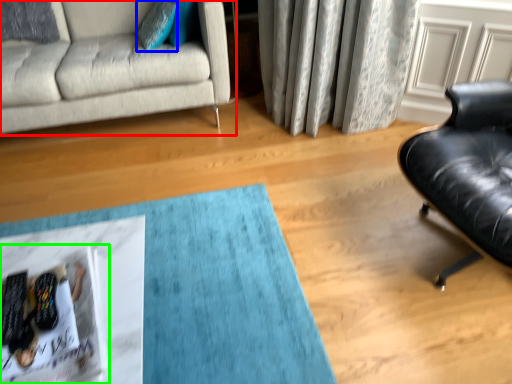
Question: Which object is positioned closest to studio couch (highlighted by a red box)? Select from pillow (highlighted by a blue box) and magazine (highlighted by a green box).

Choices:
 (A) pillow
 (B) magazine

Answer: (A)